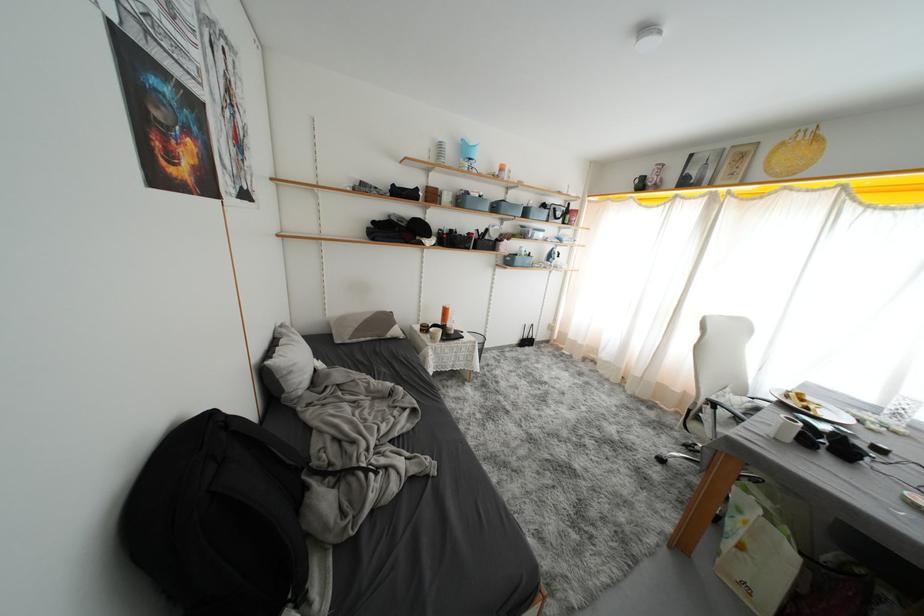
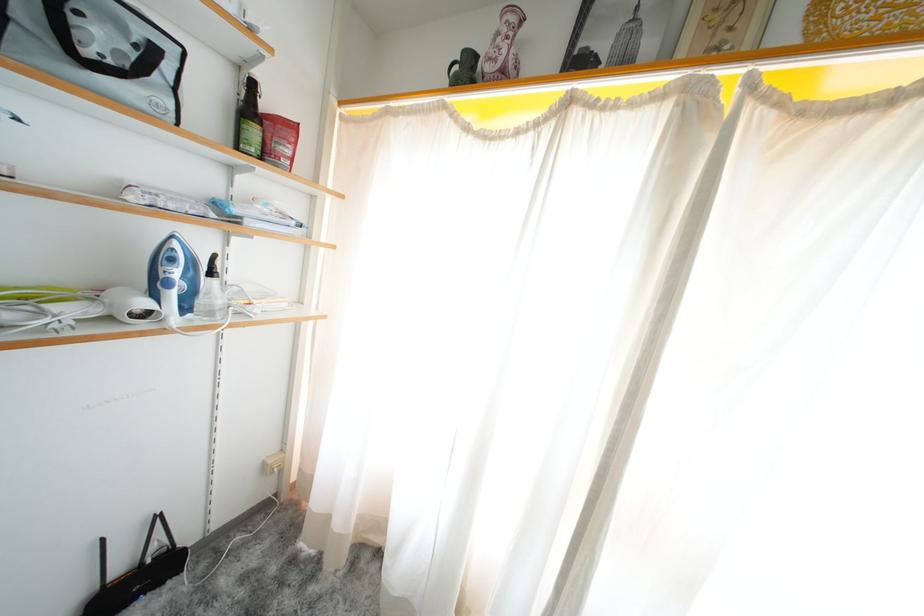
Find the pixel in the second image that matches [574,221] in the first image.

(261, 137)